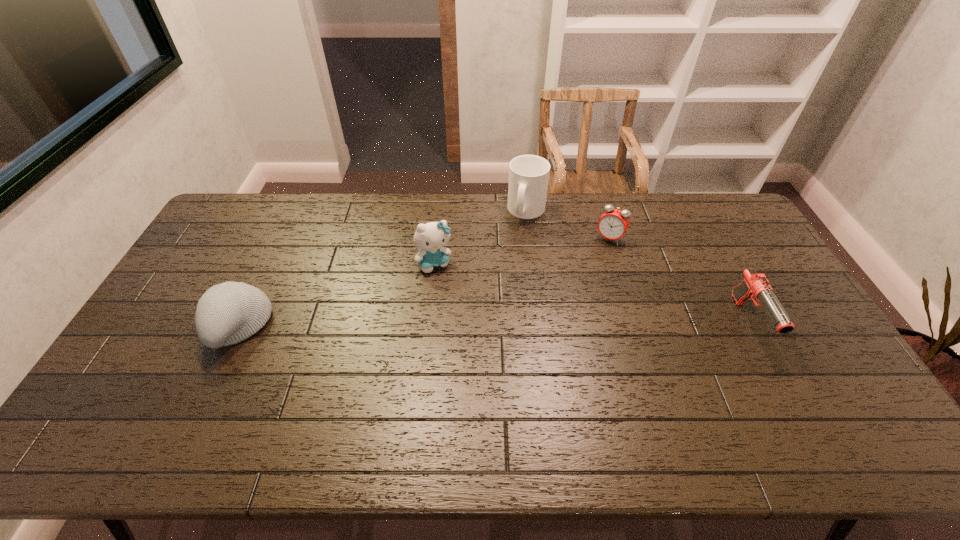
At what (x,y) coordinates should I click in order to perform the action: click on the leftmost object. Please return your answer as a coordinate pair (x, y). The height and width of the screenshot is (540, 960). Looking at the image, I should click on (228, 313).

This screenshot has height=540, width=960. What are the coordinates of `gun` in the screenshot? It's located at (755, 285).

Identify the location of the third farthest object. (430, 238).

Where is `kitten`? The height and width of the screenshot is (540, 960). kitten is located at coordinates (430, 238).

Locate an element on the screen. The width and height of the screenshot is (960, 540). the third object from left to right is located at coordinates (528, 174).

Identify the location of mug. This screenshot has width=960, height=540. (528, 174).

This screenshot has width=960, height=540. Find the location of `the fourth object from left to right`. the fourth object from left to right is located at coordinates (612, 225).

Locate an element on the screen. The width and height of the screenshot is (960, 540). alarm clock is located at coordinates (612, 225).

This screenshot has width=960, height=540. In order to click on free space located on the front of the beanie in this screenshot , I will do `click(213, 380)`.

Where is `free space located 0.140m at the aiming end of the rightmost object`? This screenshot has width=960, height=540. free space located 0.140m at the aiming end of the rightmost object is located at coordinates (792, 402).